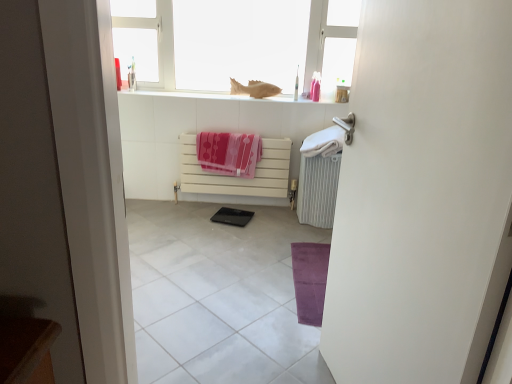
Identify the location of free location in front of white matte radiator at center. (216, 238).